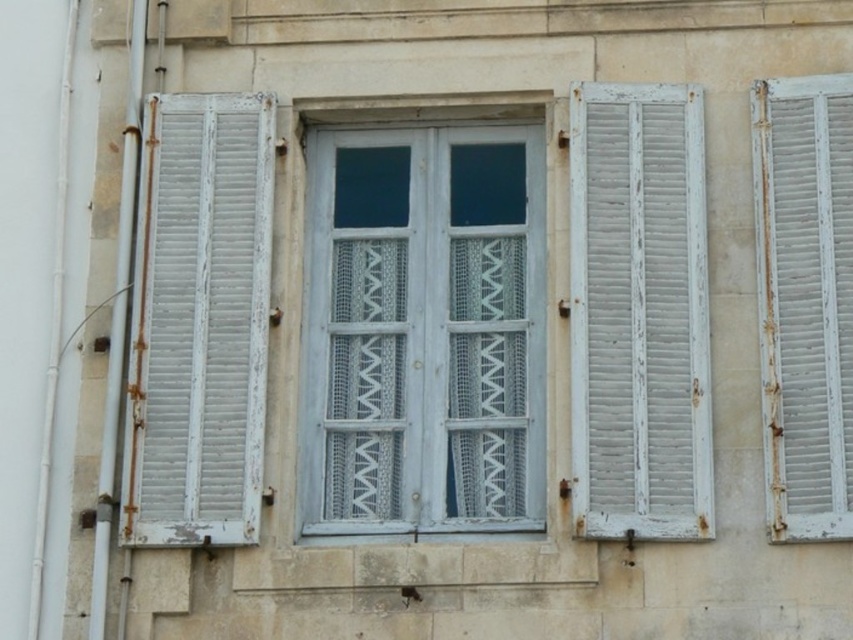
Question: Does white textured wood window at center lie in front of white wooden shutter at right?

Choices:
 (A) yes
 (B) no

Answer: (B)

Question: Which point is closer to the camera taking this photo?

Choices:
 (A) (611, 241)
 (B) (196, 316)
 (C) (845, 429)

Answer: (C)

Question: Which of the following is the closest to the observer?

Choices:
 (A) (650, 376)
 (B) (183, 481)

Answer: (B)

Question: Can you confirm if white textured wood window at center is positioned to the left of white weathered wood shutter at left?

Choices:
 (A) no
 (B) yes

Answer: (A)

Question: Can you confirm if white textured wood window at center is bigger than white wooden shutters at right?

Choices:
 (A) no
 (B) yes

Answer: (B)

Question: Which point is farther to the camera?

Choices:
 (A) white weathered wood shutter at left
 (B) white wooden shutter at right

Answer: (A)